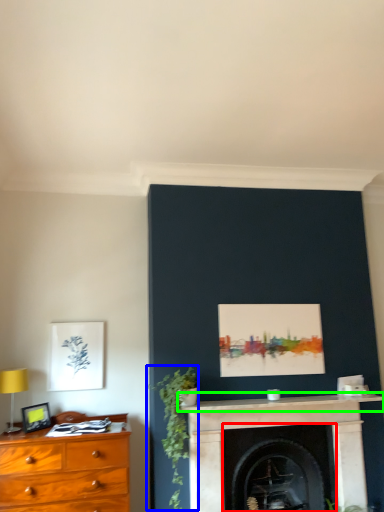
Question: Which is nearer to the fireplace (highlighted by a red box)? plant (highlighted by a blue box) or mantle (highlighted by a green box).

Choices:
 (A) plant
 (B) mantle

Answer: (B)